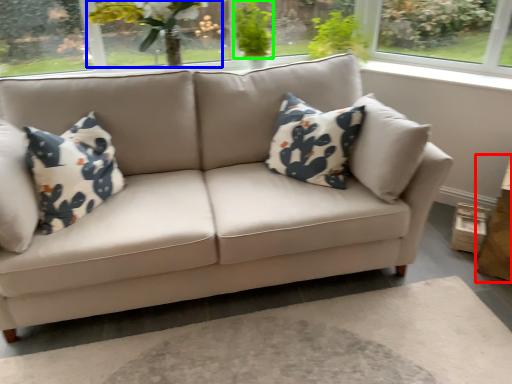
Question: Which object is positioned farthest from table (highlighted by a red box)? Select from floral arrangement (highlighted by a blue box) and plant (highlighted by a green box).

Choices:
 (A) floral arrangement
 (B) plant

Answer: (A)